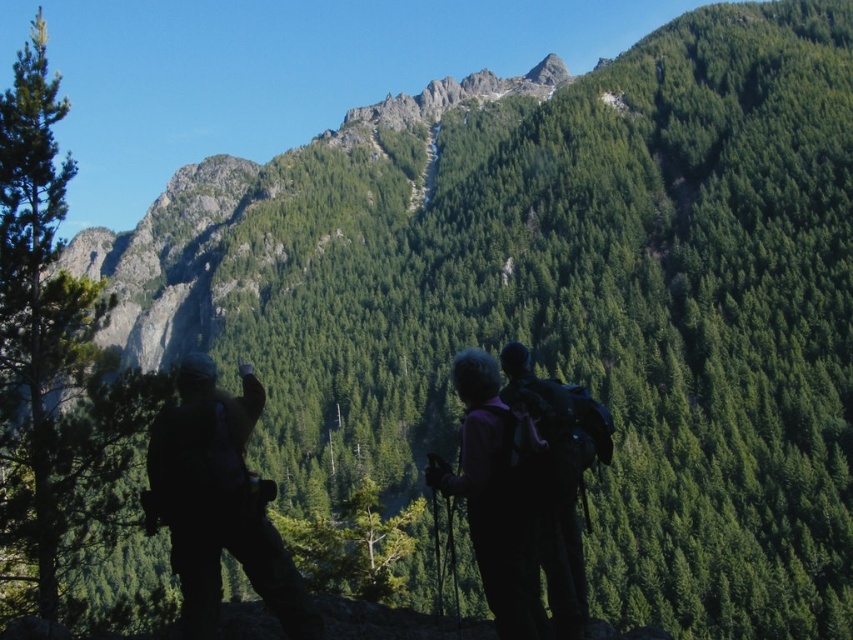
How much distance is there between silhouette backpack at left and purple fabric backpack at center?

10.85 meters

Consider the image. Does silhouette backpack at left have a lesser width compared to purple fabric backpack at center?

No.

At what (x,y) coordinates should I click in order to perform the action: click on silhouette backpack at left. Please return your answer as a coordinate pair (x, y). Looking at the image, I should click on (218, 502).

Locate an element on the screen. silhouette backpack at left is located at coordinates (218, 502).

From the picture: Which of these two, green textured tree at left or purple fabric backpack at center, stands taller?

With more height is green textured tree at left.

Is green textured tree at left wider than purple fabric backpack at center?

Correct, the width of green textured tree at left exceeds that of purple fabric backpack at center.

Locate an element on the screen. The image size is (853, 640). green textured tree at left is located at coordinates [54, 360].

In order to click on green textured tree at left in this screenshot , I will do pyautogui.click(x=54, y=360).

Can you confirm if green textured tree at left is positioned to the right of silhouette backpack at left?

Incorrect, green textured tree at left is not on the right side of silhouette backpack at left.

Is green textured tree at left behind silhouette backpack at left?

Yes, green textured tree at left is behind silhouette backpack at left.

Between point (3, 486) and point (194, 582), which one is positioned in front?

Point (194, 582)

Where is `green textured tree at left`? This screenshot has height=640, width=853. green textured tree at left is located at coordinates (54, 360).